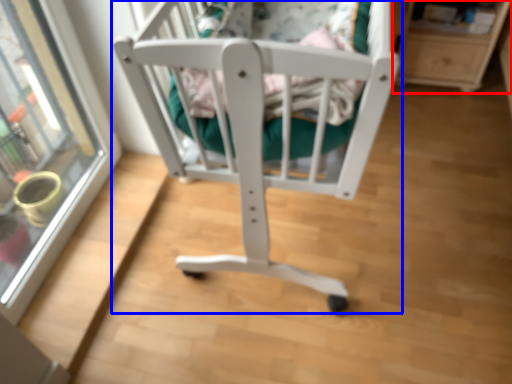
Question: Which object appears farthest to the camera in this image, shelf (highlighted by a red box) or furniture (highlighted by a blue box)?

Choices:
 (A) shelf
 (B) furniture

Answer: (A)